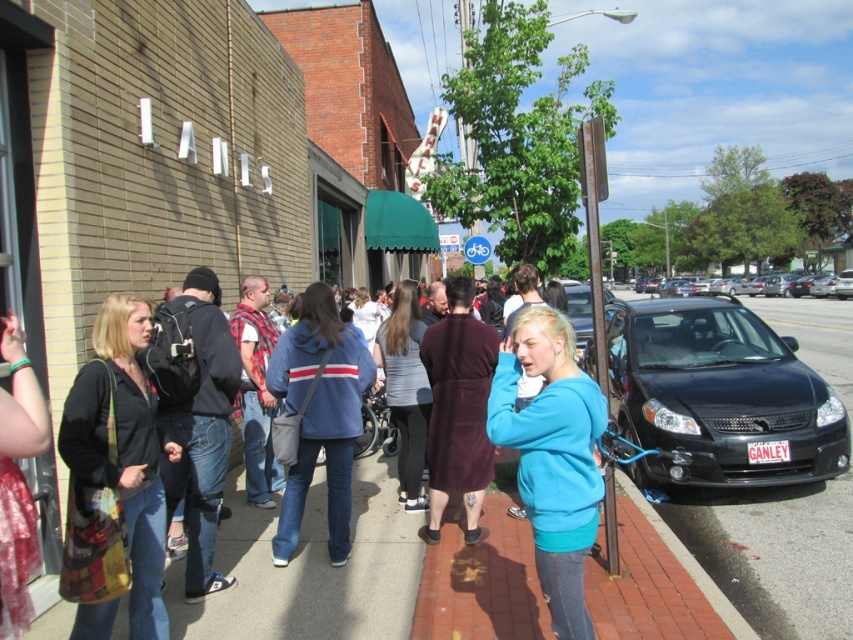
Question: Which object is the farthest from the black glossy sedan at center?

Choices:
 (A) blue fleece jacket at center
 (B) matte black jacket at left

Answer: (B)

Question: From the image, what is the correct spatial relationship of black matte hatchback at right in relation to gray fabric jacket at center?

Choices:
 (A) above
 (B) below

Answer: (A)

Question: Based on their relative distances, which object is farther from the blue cotton hoodie at center?

Choices:
 (A) black matte hatchback at right
 (B) black glossy sedan at center

Answer: (B)

Question: Can you confirm if matte black jacket at left is smaller than black glossy sedan at center?

Choices:
 (A) no
 (B) yes

Answer: (B)

Question: Considering the real-world distances, which object is closest to the blue fleece jacket at center?

Choices:
 (A) blue cotton hoodie at center
 (B) gray fabric jacket at center
 (C) black matte hatchback at right
 (D) black glossy sedan at center

Answer: (A)

Question: Considering the relative positions of blue fleece jacket at center and black glossy sedan at center in the image provided, where is blue fleece jacket at center located with respect to black glossy sedan at center?

Choices:
 (A) above
 (B) below

Answer: (B)